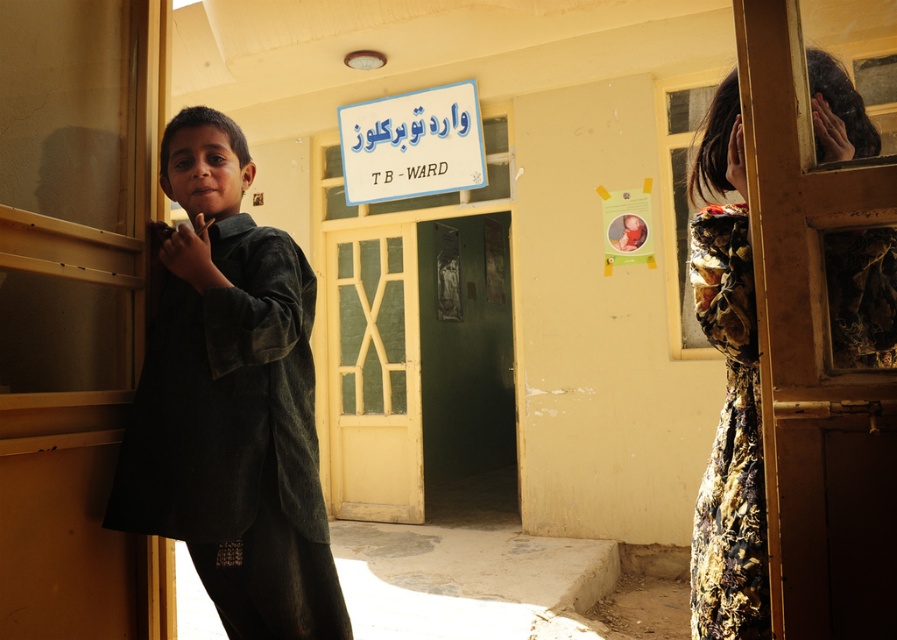
Question: Does dark green fabric at center have a smaller size compared to yellow painted wood door at center?

Choices:
 (A) no
 (B) yes

Answer: (B)

Question: Which of the following is the farthest from the observer?

Choices:
 (A) (231, 636)
 (B) (379, 195)
 (C) (724, 513)

Answer: (B)

Question: Is dark green fabric at center above yellow painted wood door at center?

Choices:
 (A) yes
 (B) no

Answer: (A)

Question: Which point appears closest to the camera in this image?

Choices:
 (A) (698, 628)
 (B) (335, 412)
 (C) (249, 454)
 (D) (392, 104)

Answer: (C)

Question: Estimate the real-world distances between objects in this image. Which object is closer to the floral dress at right?

Choices:
 (A) dark green fabric at center
 (B) white plastic sign at upper center

Answer: (A)

Question: Does floral dress at right appear on the left side of white plastic sign at center?

Choices:
 (A) yes
 (B) no

Answer: (B)